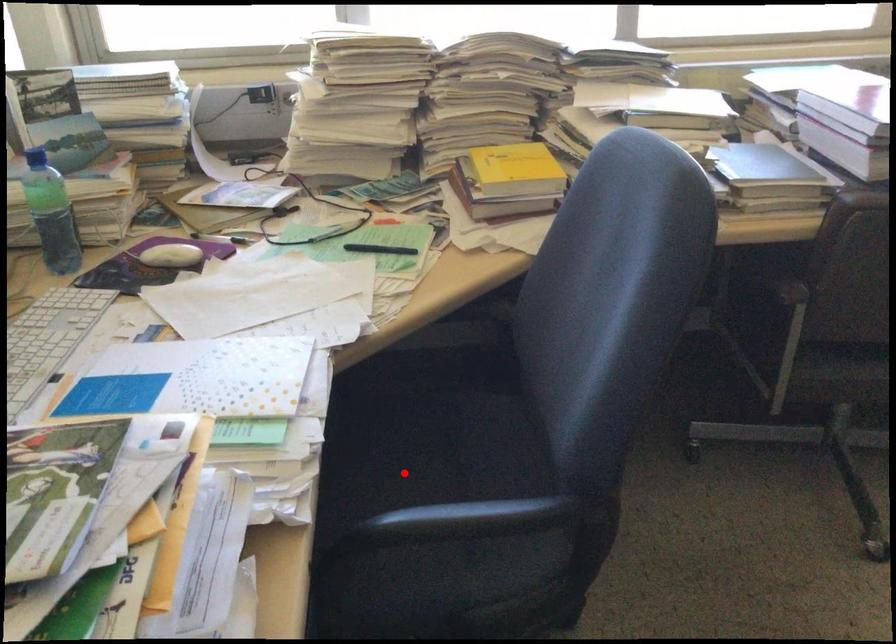
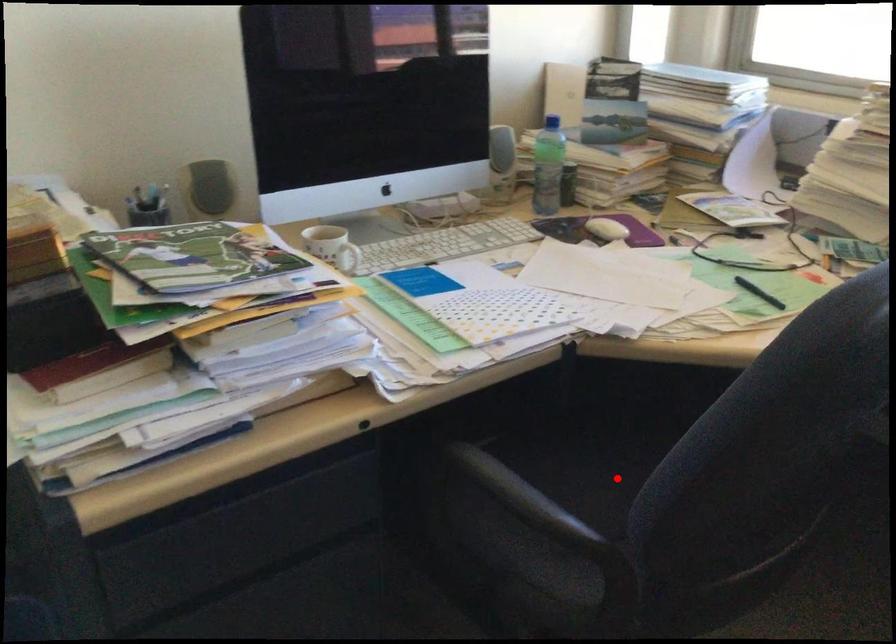
I am providing you with two images of the same scene from different viewpoints. A red point is marked on the first image and another point is marked on the second image. Does the point marked in image1 correspond to the same location as the one in image2?

Yes